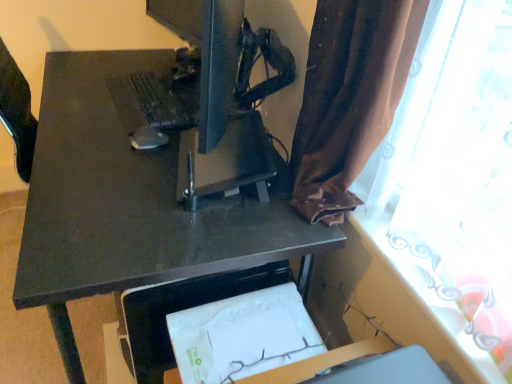
Question: From the image's perspective, is matte black monitor at center located above or below matte black keyboard at upper left?

Choices:
 (A) above
 (B) below

Answer: (A)

Question: Looking at the image, does matte black monitor at center seem bigger or smaller compared to matte black keyboard at upper left?

Choices:
 (A) big
 (B) small

Answer: (A)

Question: Considering the real-world distances, which object is closest to the matte black monitor at center?

Choices:
 (A) brown fabric curtain at upper right
 (B) matte black desk at center
 (C) matte black keyboard at upper left
 (D) matte black mouse at center

Answer: (C)

Question: Which of these objects is positioned closest to the matte black monitor at center?

Choices:
 (A) brown fabric curtain at upper right
 (B) matte black desk at center
 (C) matte black keyboard at upper left
 (D) matte black mouse at center

Answer: (C)